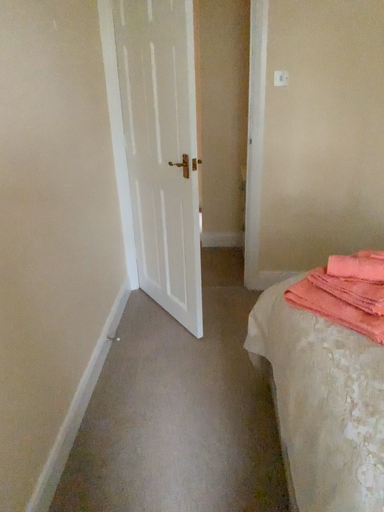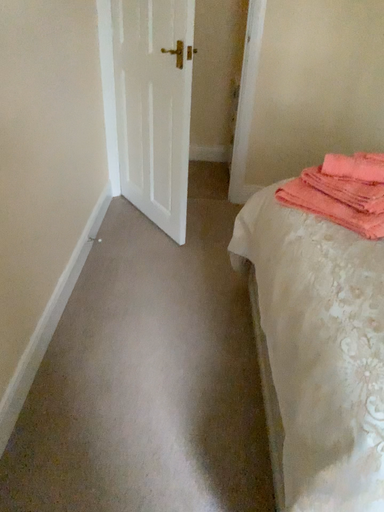
Question: How did the camera likely rotate when shooting the video?

Choices:
 (A) rotated downward
 (B) rotated upward

Answer: (A)